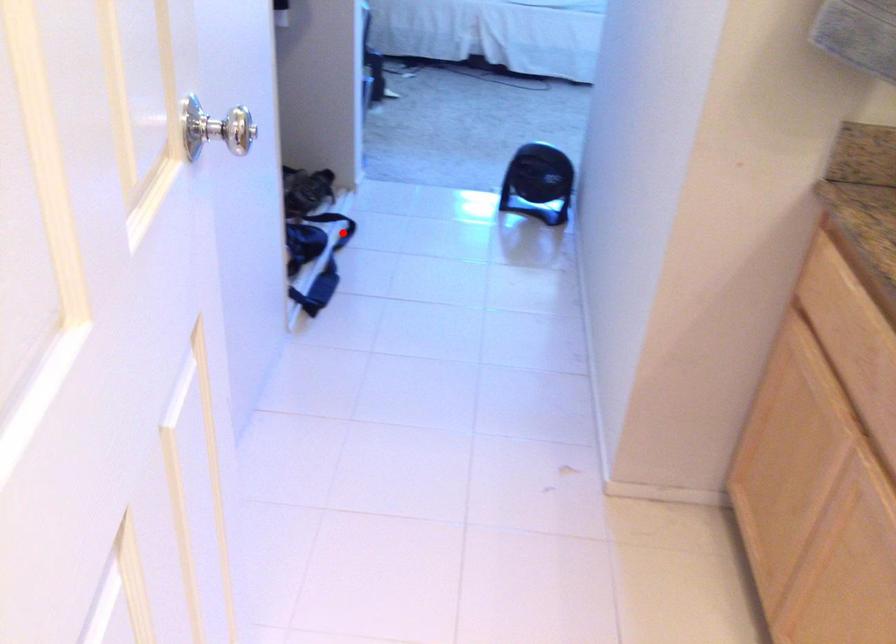
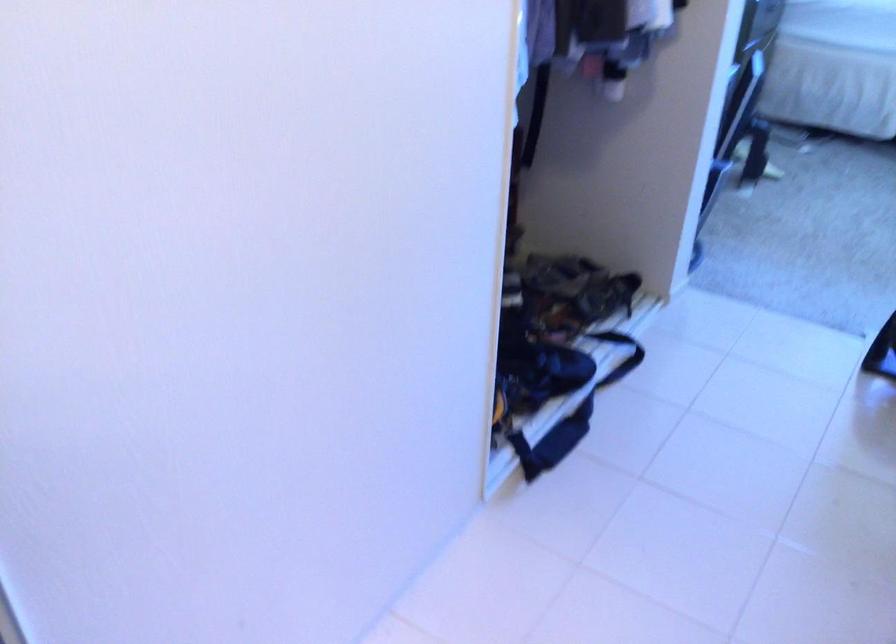
The point at the highlighted location is marked in the first image. Where is the corresponding point in the second image?

(621, 355)